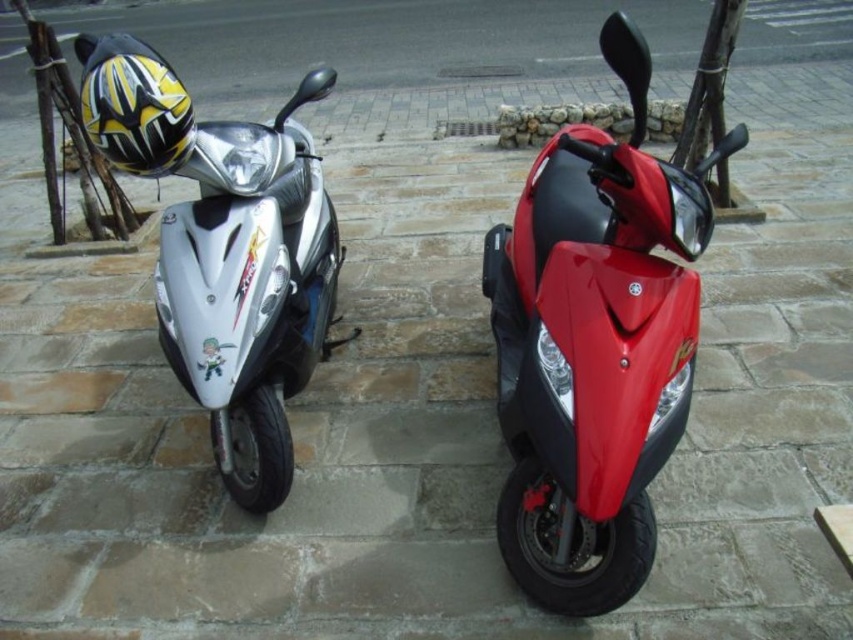
Question: Which point appears farthest from the camera in this image?

Choices:
 (A) (218, 348)
 (B) (640, 372)

Answer: (A)

Question: Does shiny red scooter at center appear on the left side of shiny silver scooter at left?

Choices:
 (A) yes
 (B) no

Answer: (B)

Question: Is shiny red scooter at center smaller than shiny silver scooter at left?

Choices:
 (A) no
 (B) yes

Answer: (B)

Question: Which point is farther to the camera?

Choices:
 (A) (231, 291)
 (B) (654, 541)

Answer: (A)

Question: Does shiny red scooter at center have a larger size compared to shiny silver scooter at left?

Choices:
 (A) no
 (B) yes

Answer: (A)